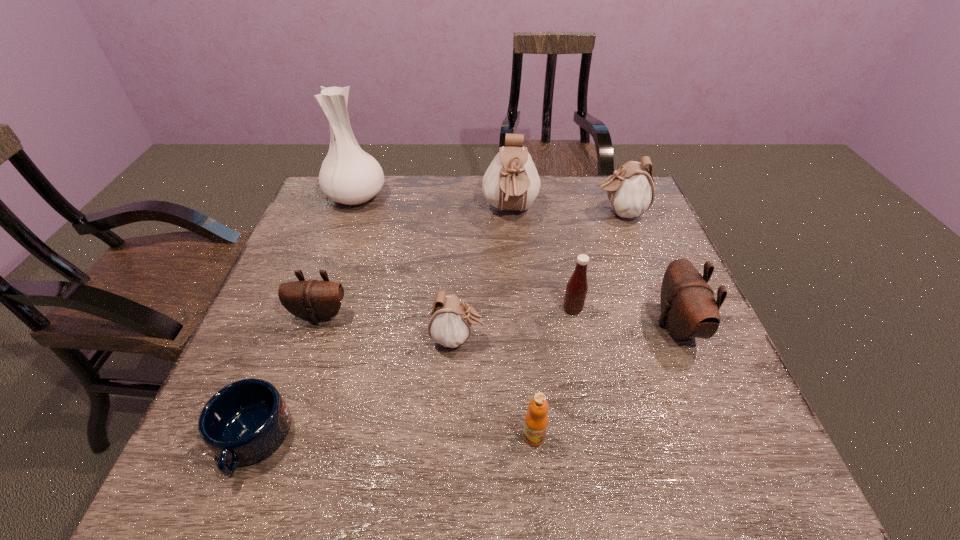
The width and height of the screenshot is (960, 540). Identify the location of white vase. (348, 175).

Locate an element on the screen. vase is located at coordinates (348, 175).

Identify the location of the biggest white pouch. The image size is (960, 540). (511, 182).

Locate an element on the screen. The width and height of the screenshot is (960, 540). the tallest pouch is located at coordinates (511, 182).

Find the location of a particular element. the second smallest white pouch is located at coordinates (630, 190).

You are a GUI agent. You are given a task and a screenshot of the screen. Output one action in this format:
    pyautogui.click(x=<x>, y=<y>)
    Task: Click on the Tabasco sauce
    
    Given the screenshot: What is the action you would take?
    pyautogui.click(x=576, y=290)

Identify the location of white Tabasco sauce. Image resolution: width=960 pixels, height=540 pixels. (576, 290).

Locate an element on the screen. This screenshot has height=540, width=960. the bigger brown pouch is located at coordinates (688, 307).

The width and height of the screenshot is (960, 540). Identify the location of the nearest white pouch. (450, 320).

At what (x,y) coordinates should I click in order to perform the action: click on orange juice. Please return your answer as a coordinate pair (x, y). The height and width of the screenshot is (540, 960). Looking at the image, I should click on (536, 419).